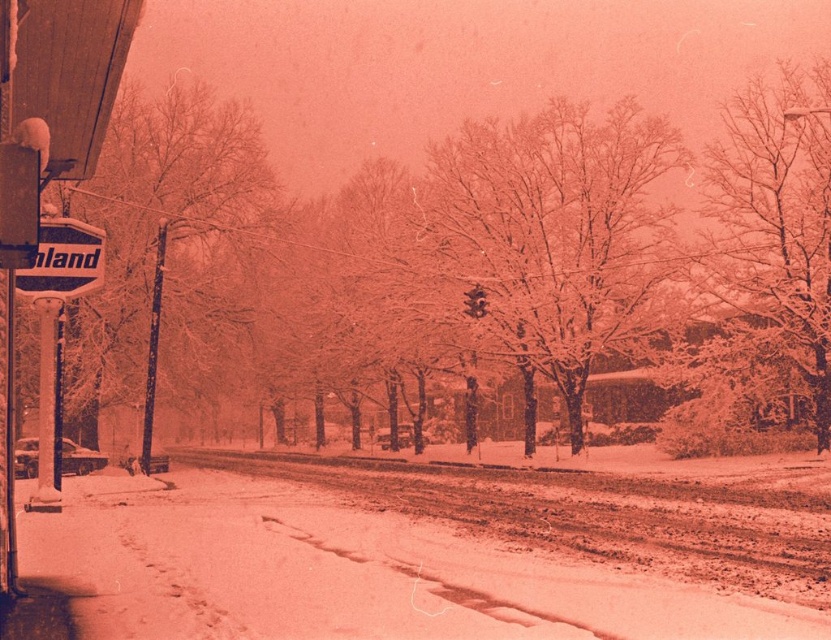
Is snow-covered tree at upper right positioned before metallic silver sign at left?

That is False.

The width and height of the screenshot is (831, 640). What do you see at coordinates (773, 240) in the screenshot?
I see `snow-covered tree at upper right` at bounding box center [773, 240].

Which is in front, point (750, 252) or point (47, 230)?

Point (47, 230)

This screenshot has width=831, height=640. In order to click on snow-covered tree at upper right in this screenshot , I will do `click(773, 240)`.

Which of these two, snow-covered tree at center or metallic silver sign at left, stands shorter?

Standing shorter between the two is metallic silver sign at left.

The height and width of the screenshot is (640, 831). I want to click on snow-covered tree at center, so click(554, 232).

The image size is (831, 640). What are the coordinates of `snow-covered tree at center` in the screenshot? It's located at (554, 232).

You are a GUI agent. You are given a task and a screenshot of the screen. Output one action in this format:
    pyautogui.click(x=<x>, y=<y>)
    Task: Click on the snow-covered tree at center
    The image size is (831, 640).
    Given the screenshot: What is the action you would take?
    pyautogui.click(x=554, y=232)

Which is behind, point (608, 125) or point (131, 141)?

The point (608, 125) is more distant.

Locate an element on the screen. This screenshot has width=831, height=640. snow-covered tree at center is located at coordinates (554, 232).